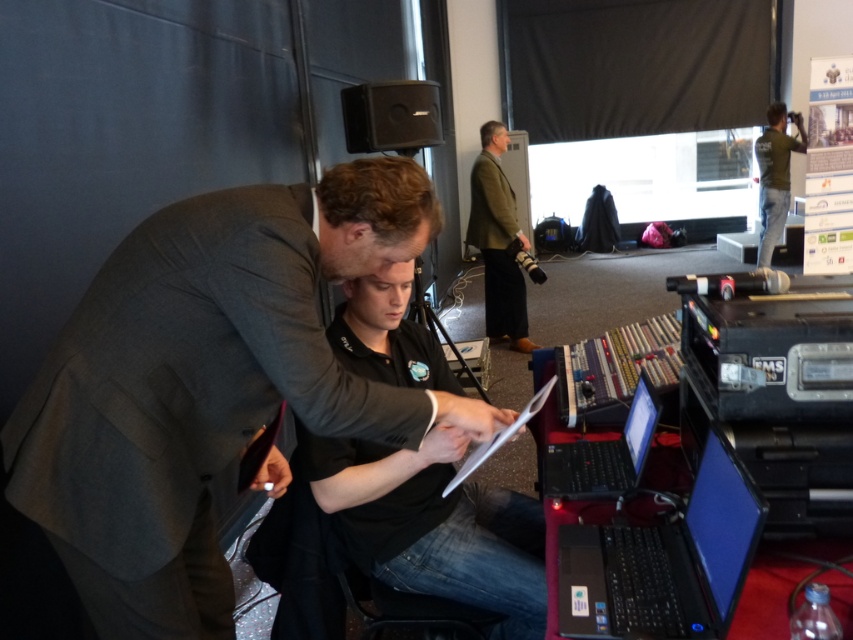
You are standing at the point labeled point (485, 243) and want to walk to the door located at point (579, 440). Is there a clear path between these two points?

Since point (485, 243) is behind point (579, 440), there is a clear path between them, so you can walk directly to the door.

You are organizing a photo shoot and need to ensure that the dark gray suit at center and the green woolen blazer at center are visible in the frame. Based on their sizes, which one might require more careful positioning to avoid being obscured by other elements?

The dark gray suit at center is smaller than the green woolen blazer at center, so it might require more careful positioning to avoid being obscured by other elements.

You are organizing a small event and need to place a rectangular box that is 1.2 meters wide between the black matte shirt at center and the black matte laptop at lower right. Based on their widths, will the box fit between them without overlapping?

The black matte shirt at center is wider than the black matte laptop at lower right. Since the box is 1.2 meters wide, and the combined width of both objects is not provided, it is impossible to determine if the box will fit without overlapping. Additional information about the total available space between them is needed.